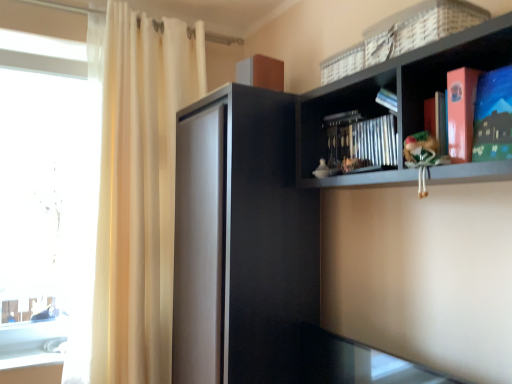
Question: Considering the relative sizes of matte paper book at upper right and white sheer curtain at left in the image provided, is matte paper book at upper right shorter than white sheer curtain at left?

Choices:
 (A) yes
 (B) no

Answer: (A)

Question: Is matte paper book at upper right to the right of white sheer curtain at left from the viewer's perspective?

Choices:
 (A) no
 (B) yes

Answer: (B)

Question: Is the depth of matte paper book at upper right greater than that of white sheer curtain at left?

Choices:
 (A) no
 (B) yes

Answer: (A)

Question: Is matte paper book at upper right outside white sheer curtain at left?

Choices:
 (A) no
 (B) yes

Answer: (B)

Question: Is matte paper book at upper right placed right next to white sheer curtain at left?

Choices:
 (A) no
 (B) yes

Answer: (A)

Question: Does matte paper book at upper right lie in front of white sheer curtain at left?

Choices:
 (A) no
 (B) yes

Answer: (B)

Question: Is the depth of green fabric doll at right greater than that of black matte cabinet at center?

Choices:
 (A) no
 (B) yes

Answer: (A)

Question: Does green fabric doll at right have a smaller size compared to black matte cabinet at center?

Choices:
 (A) yes
 (B) no

Answer: (A)

Question: Is green fabric doll at right at the left side of black matte cabinet at center?

Choices:
 (A) yes
 (B) no

Answer: (B)

Question: Is green fabric doll at right taller than black matte cabinet at center?

Choices:
 (A) no
 (B) yes

Answer: (A)

Question: Does green fabric doll at right have a greater width compared to black matte cabinet at center?

Choices:
 (A) yes
 (B) no

Answer: (B)

Question: Considering the relative sizes of green fabric doll at right and black matte cabinet at center in the image provided, is green fabric doll at right bigger than black matte cabinet at center?

Choices:
 (A) no
 (B) yes

Answer: (A)

Question: From the image's perspective, does white woven basket at upper right appear higher than matte paper book at upper right?

Choices:
 (A) yes
 (B) no

Answer: (A)